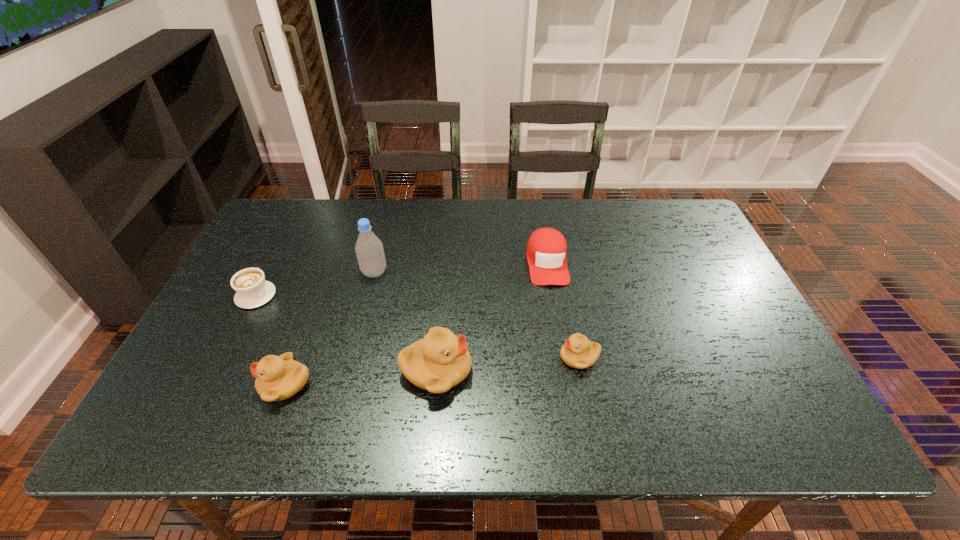
Where is `the second object from left to right`? the second object from left to right is located at coordinates (278, 378).

Where is `the leftmost duckling`? This screenshot has height=540, width=960. the leftmost duckling is located at coordinates (278, 378).

Where is `the fifth shortest object`? The width and height of the screenshot is (960, 540). the fifth shortest object is located at coordinates (438, 362).

I want to click on the tallest duckling, so click(438, 362).

Identify the location of the shortest duckling. Image resolution: width=960 pixels, height=540 pixels. (578, 352).

Find the location of a particular element. baseball cap is located at coordinates (546, 251).

What are the coordinates of `the third object from left to right` in the screenshot? It's located at (369, 250).

Image resolution: width=960 pixels, height=540 pixels. Find the location of `bottle`. bottle is located at coordinates (369, 250).

Locate an element on the screen. This screenshot has height=540, width=960. the leftmost object is located at coordinates (252, 290).

At what (x,y) coordinates should I click in order to perform the action: click on vacant area situated 0.140m at the beak of the second tallest duckling. Please return your answer as a coordinate pair (x, y). This screenshot has height=540, width=960. Looking at the image, I should click on (198, 384).